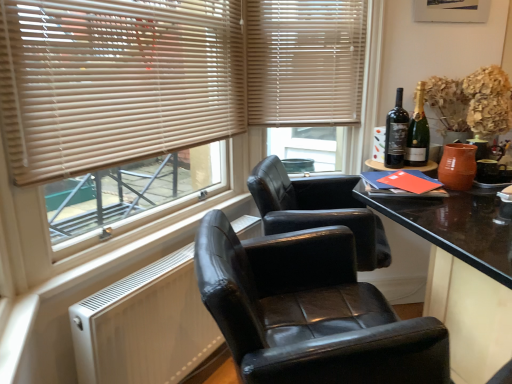
This screenshot has height=384, width=512. I want to click on blank space situated above beige wood blinds at upper center (from a real-world perspective), so click(x=324, y=0).